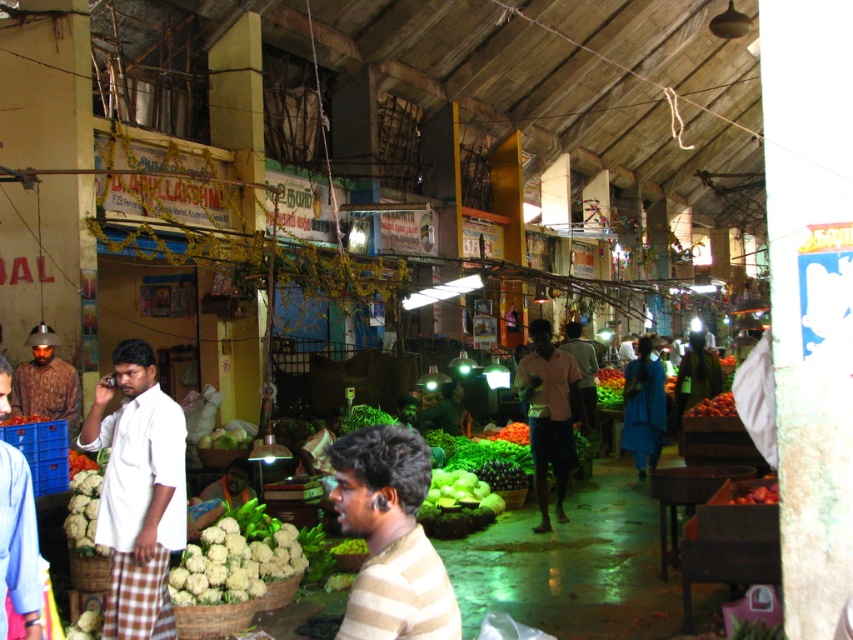
Based on the photo, does white shirt at left appear on the left side of green fabric shirt at center?

Indeed, white shirt at left is positioned on the left side of green fabric shirt at center.

Can you confirm if white shirt at left is positioned below green fabric shirt at center?

Actually, white shirt at left is above green fabric shirt at center.

Is point (38, 598) positioned before point (445, 392)?

Yes.

At what (x,y) coordinates should I click in order to perform the action: click on white shirt at left. Please return your answer as a coordinate pair (x, y). Looking at the image, I should click on (16, 544).

Is pink cotton shirt at center in front of shiny red apples at lower right?

No, pink cotton shirt at center is further to the viewer.

Who is more distant from viewer, (538, 320) or (764, 496)?

The point (538, 320) is more distant.

Image resolution: width=853 pixels, height=640 pixels. What are the coordinates of `pink cotton shirt at center` in the screenshot? It's located at (549, 413).

Locate an element on the screen. pink cotton shirt at center is located at coordinates (549, 413).

Who is taller, white cotton shirt at center or white cauliflower at lower center?

With more height is white cotton shirt at center.

Who is more distant from viewer, (125, 458) or (265, 541)?

The point (265, 541) is behind.

Is point (132, 365) positioned in front of point (263, 541)?

Yes, it is in front of point (263, 541).

This screenshot has height=640, width=853. In order to click on white cotton shirt at center in this screenshot , I will do `click(138, 492)`.